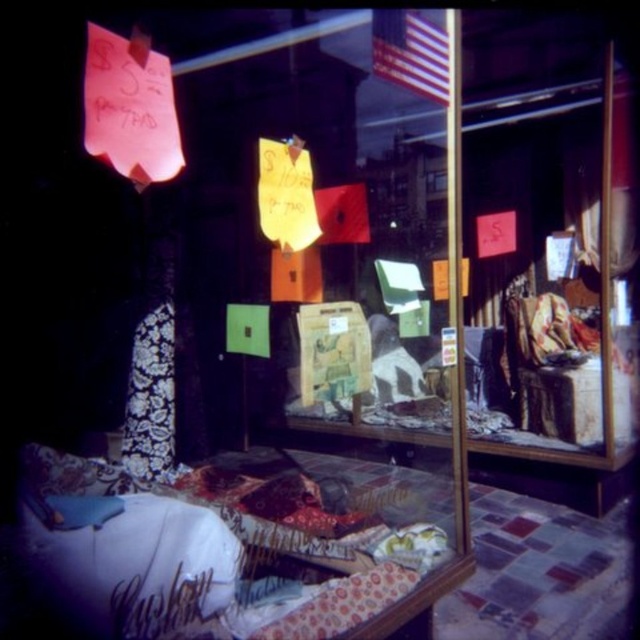
Question: Which point appears closest to the camera in this image?

Choices:
 (A) pyautogui.click(x=440, y=80)
 (B) pyautogui.click(x=360, y=196)

Answer: (A)

Question: Estimate the real-world distances between objects in this image. Which object is farther from the red fabric flag at center?

Choices:
 (A) american flag at upper center
 (B) silver metallic script at lower left

Answer: (B)

Question: Among these points, which one is farthest from the camera?

Choices:
 (A) (166, 600)
 (B) (384, 26)

Answer: (B)

Question: Is american flag at upper center above red fabric flag at center?

Choices:
 (A) yes
 (B) no

Answer: (A)

Question: Is the position of american flag at upper center less distant than that of red fabric flag at center?

Choices:
 (A) yes
 (B) no

Answer: (A)

Question: In this image, where is american flag at upper center located relative to silver metallic script at lower left?

Choices:
 (A) left
 (B) right

Answer: (B)